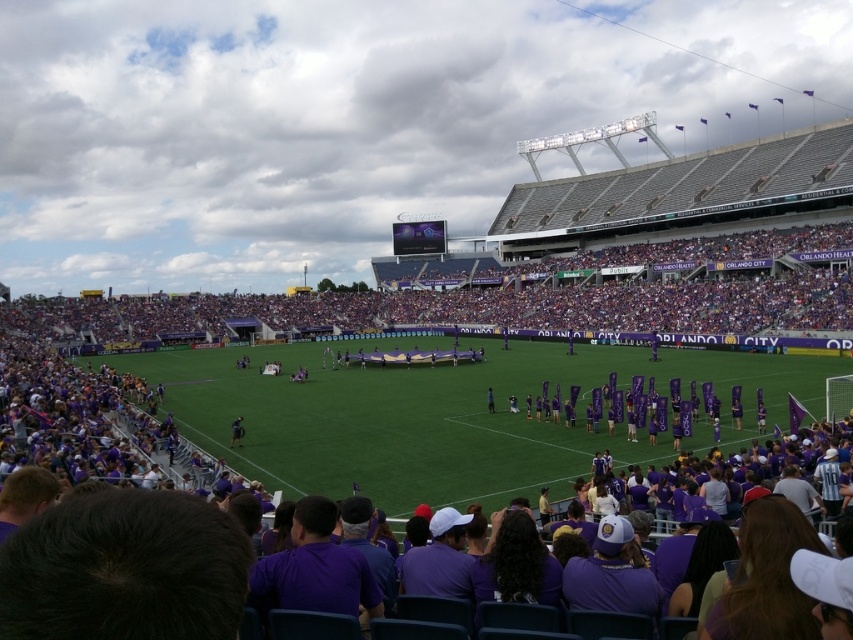
You are a photographer standing at the edge of the field. You want to take a photo that includes both the green grass football field at center and the dark blue jersey at center. Based on their positions, which object should appear larger in your photo?

The green grass football field at center is above the dark blue jersey at center, so the dark blue jersey at center will appear smaller in the photo since it is positioned lower and farther from the camera.

You are a photographer positioned at the center of the soccer field during the halftime show. You want to take a photo that includes both the point at coordinates point (281, 461) and point (231, 445). Which point should you focus on first to ensure both are in focus?

You should focus on point (281, 461) first because it is closer to the camera than point (231, 445), ensuring that both points will be within the depth of field.

You are a photographer positioned at the edge of the field. You want to take a photo that includes both the green grass football field at center and the dark blue jersey at center. Which object will appear larger in your photo?

The green grass football field at center will appear larger in the photo because it is closer to the viewer than the dark blue jersey at center.